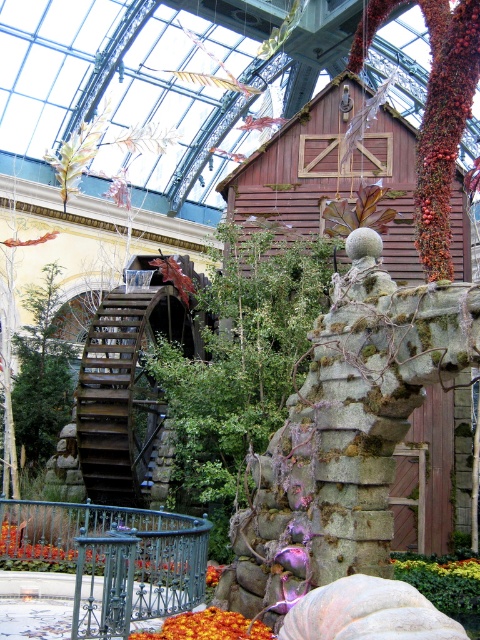
You are a gardener who needs to water both the green leafy plant at center and the orange matte flower at lower center. Which of the two requires more water based on their sizes?

The green leafy plant at center is bigger than the orange matte flower at lower center, so it likely requires more water.

You are standing in front of the rustic wooden structure and want to take a photo of the point at coordinates (415,564). The camera you are using has a maximum focus range of 50 meters. Will the camera be able to focus on the point?

The point at coordinates (415,564) is 51.50 meters away from the camera. Since the camera can only focus up to 50 meters, it will not be able to focus on the point.